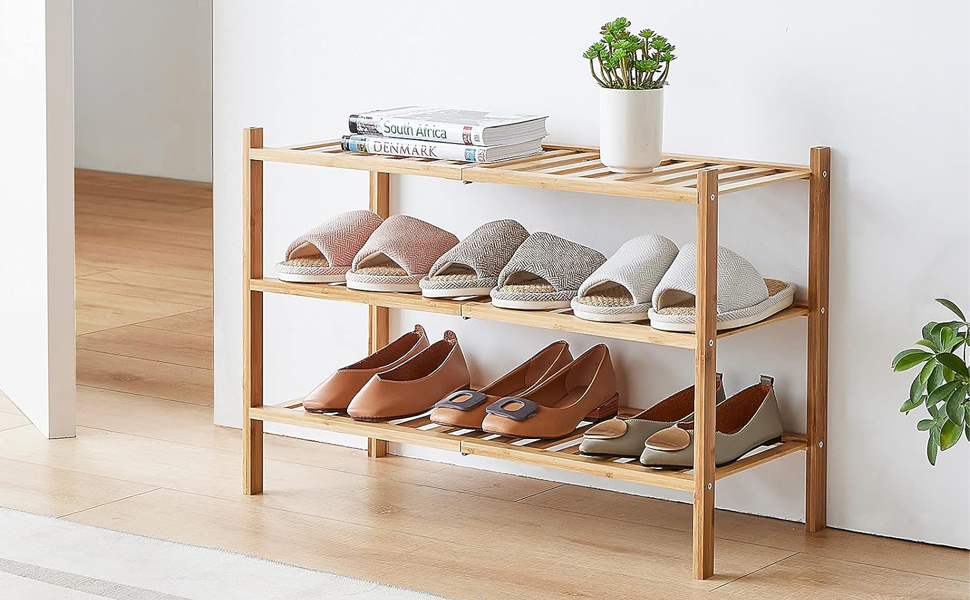
The width and height of the screenshot is (970, 600). In order to click on slippers in this screenshot , I will do tap(681, 280), tap(629, 280), tap(553, 270), tap(480, 253), tap(388, 250), tap(321, 246).